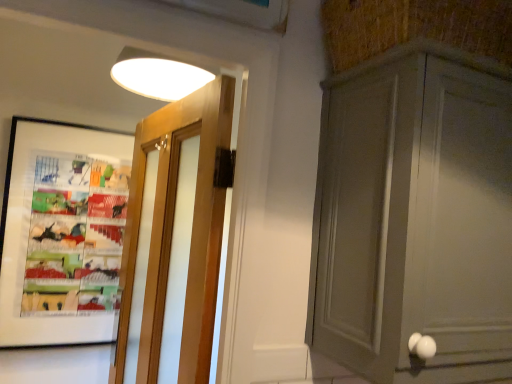
Question: Considering the relative sizes of matte gray cabinet at right and wooden door at left in the image provided, is matte gray cabinet at right bigger than wooden door at left?

Choices:
 (A) yes
 (B) no

Answer: (A)

Question: Does matte gray cabinet at right have a smaller size compared to wooden door at left?

Choices:
 (A) yes
 (B) no

Answer: (B)

Question: From the image's perspective, does matte gray cabinet at right appear higher than wooden door at left?

Choices:
 (A) yes
 (B) no

Answer: (A)

Question: Can you confirm if matte gray cabinet at right is wider than wooden door at left?

Choices:
 (A) yes
 (B) no

Answer: (A)

Question: From the image's perspective, is matte gray cabinet at right below wooden door at left?

Choices:
 (A) no
 (B) yes

Answer: (A)

Question: From a real-world perspective, is matte gray cabinet at right on top of wooden door at left?

Choices:
 (A) yes
 (B) no

Answer: (A)

Question: Does matte black picture frame at left have a lesser width compared to wooden door at left?

Choices:
 (A) no
 (B) yes

Answer: (B)

Question: From the image's perspective, is matte black picture frame at left beneath wooden door at left?

Choices:
 (A) yes
 (B) no

Answer: (B)

Question: From the image's perspective, is matte black picture frame at left over wooden door at left?

Choices:
 (A) yes
 (B) no

Answer: (A)

Question: Considering the relative sizes of matte black picture frame at left and wooden door at left in the image provided, is matte black picture frame at left shorter than wooden door at left?

Choices:
 (A) no
 (B) yes

Answer: (B)

Question: From a real-world perspective, is matte black picture frame at left located higher than wooden door at left?

Choices:
 (A) no
 (B) yes

Answer: (B)

Question: Is wooden door at left at the back of matte black picture frame at left?

Choices:
 (A) yes
 (B) no

Answer: (B)

Question: From the image's perspective, is matte gray cabinet at right beneath matte black picture frame at left?

Choices:
 (A) yes
 (B) no

Answer: (B)